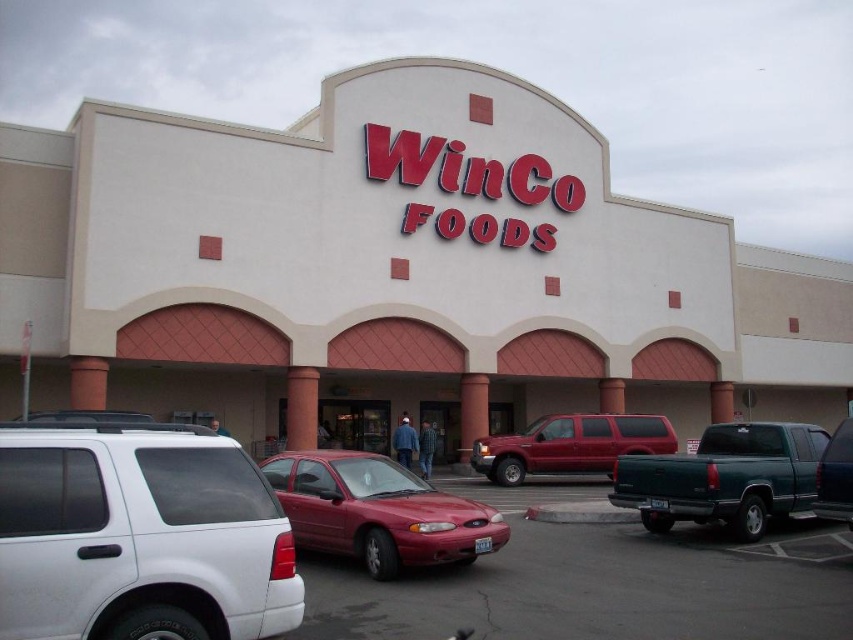
Question: Can you confirm if white matte building at center is positioned above white matte suv at lower left?

Choices:
 (A) yes
 (B) no

Answer: (A)

Question: Which is farther from the shiny red suv at center?

Choices:
 (A) white matte building at center
 (B) metallic dark green truck at right
 (C) white matte suv at lower left

Answer: (C)

Question: Among these objects, which one is nearest to the camera?

Choices:
 (A) green matte truck at right
 (B) metallic dark green truck at right
 (C) metallic red car at center

Answer: (C)

Question: Which object appears closest to the camera in this image?

Choices:
 (A) shiny red suv at center
 (B) metallic red car at center
 (C) white matte building at center
 (D) green matte truck at right

Answer: (B)

Question: Is white matte suv at lower left bigger than green matte truck at right?

Choices:
 (A) no
 (B) yes

Answer: (A)

Question: Is white matte building at center thinner than shiny red suv at center?

Choices:
 (A) yes
 (B) no

Answer: (B)